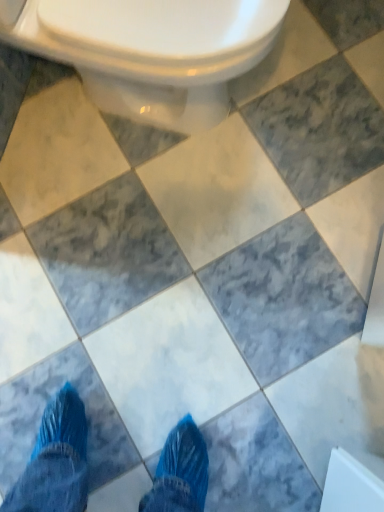
What do you see at coordinates (150, 51) in the screenshot? Image resolution: width=384 pixels, height=512 pixels. I see `white glossy toilet at upper center` at bounding box center [150, 51].

This screenshot has height=512, width=384. Identify the location of white glossy toilet at upper center. (150, 51).

The width and height of the screenshot is (384, 512). What are the coordinates of `white glossy toilet at upper center` in the screenshot? It's located at (150, 51).